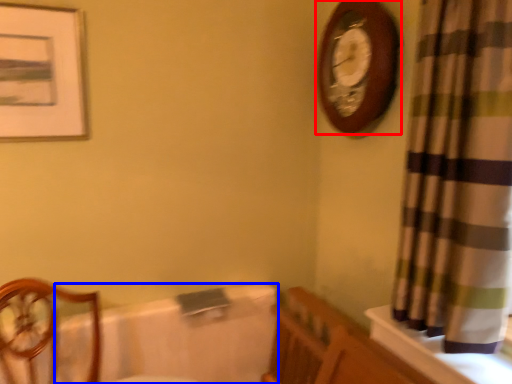
Question: Among these objects, which one is farthest to the camera, wall clock (highlighted by a red box) or bath (highlighted by a blue box)?

Choices:
 (A) wall clock
 (B) bath

Answer: (B)